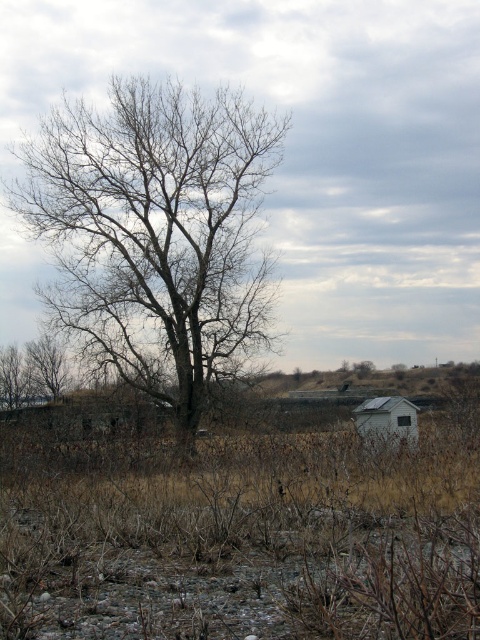
Question: Which of the following is the farthest from the observer?

Choices:
 (A) bare branches at center
 (B) white matte hut at lower right

Answer: (A)

Question: Among these objects, which one is nearest to the camera?

Choices:
 (A) white matte hut at lower right
 (B) bare branches at center

Answer: (A)

Question: Is bare branches at center positioned at the back of white matte hut at lower right?

Choices:
 (A) no
 (B) yes

Answer: (B)

Question: Does bare branches at center have a greater width compared to white matte hut at lower right?

Choices:
 (A) yes
 (B) no

Answer: (A)

Question: Does bare branches at center come behind white matte hut at lower right?

Choices:
 (A) no
 (B) yes

Answer: (B)

Question: Which of the following is the farthest from the observer?

Choices:
 (A) (218, 205)
 (B) (396, 406)

Answer: (A)